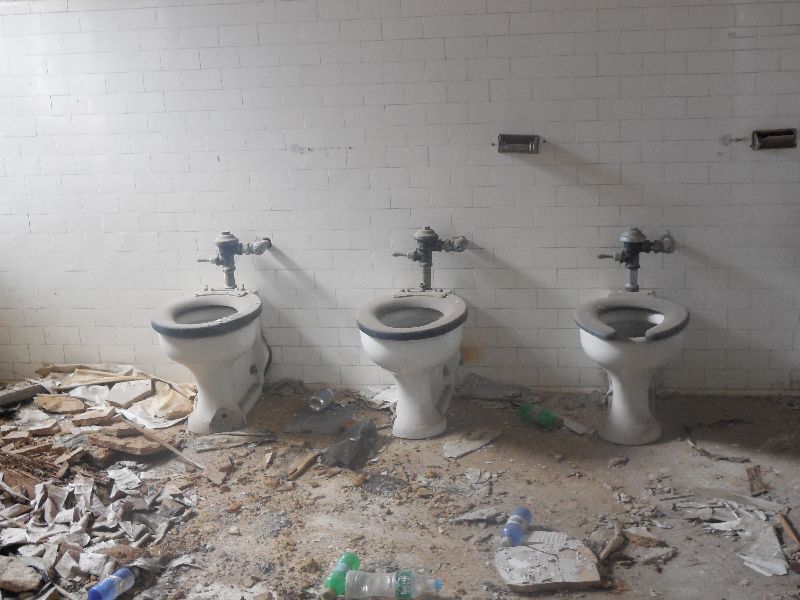
You are a GUI agent. You are given a task and a screenshot of the screen. Output one action in this format:
    pyautogui.click(x=<x>, y=<y>)
    Task: Click on the bottle
    
    Given the screenshot: What is the action you would take?
    pyautogui.click(x=342, y=574)